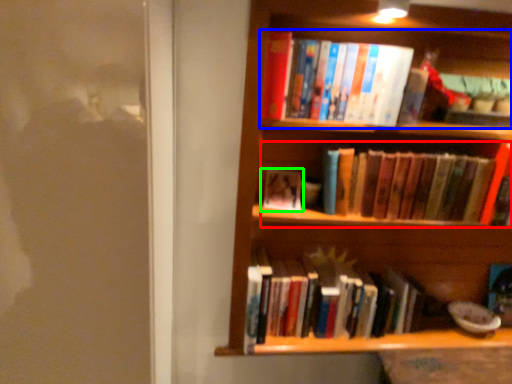
Question: Which object is positioned closest to book (highlighted by a red box)? Select from book (highlighted by a blue box) and book (highlighted by a green box).

Choices:
 (A) book
 (B) book

Answer: (A)